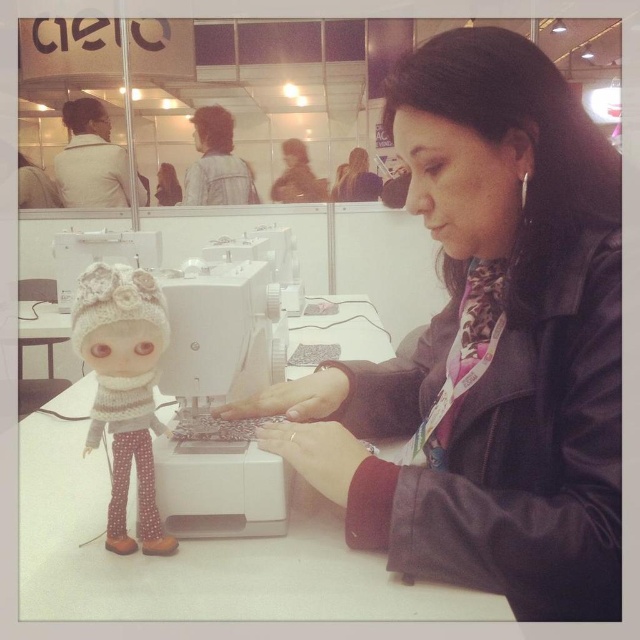
Question: Estimate the real-world distances between objects in this image. Which object is farther from the white knitted doll at lower left?

Choices:
 (A) white plastic sewing machine at center
 (B) leather jacket at center
 (C) leather jacket at upper center

Answer: (C)

Question: Does white plastic sewing machine at center have a lesser width compared to white knitted doll at lower left?

Choices:
 (A) yes
 (B) no

Answer: (B)

Question: Is leather jacket at center wider than leather jacket at upper center?

Choices:
 (A) no
 (B) yes

Answer: (B)

Question: Which object is positioned closest to the leather jacket at upper center?

Choices:
 (A) matte black jacket at upper center
 (B) white plastic sewing machine at center
 (C) leather jacket at center

Answer: (A)

Question: Which object is positioned closest to the white plastic sewing machine at center?

Choices:
 (A) matte black jacket at upper center
 (B) white knitted doll at lower left

Answer: (B)

Question: Is leather jacket at center thinner than white knitted doll at lower left?

Choices:
 (A) yes
 (B) no

Answer: (B)